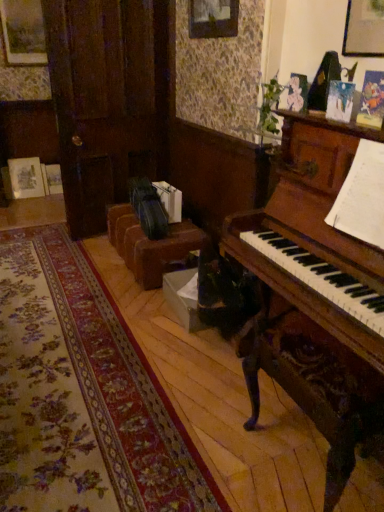
In order to face wooden picture frame at upper right, should I rotate leftwards or rightwards?

You should look right and rotate roughly 24.208 degrees.

This screenshot has width=384, height=512. Describe the element at coordinates (364, 29) in the screenshot. I see `wooden picture frame at upper right` at that location.

Find the location of `wooden picture frame at upper right`. wooden picture frame at upper right is located at coordinates (364, 29).

What is the approximate height of brown leather couch at center?

brown leather couch at center is 13.59 inches tall.

Describe the element at coordinates (150, 245) in the screenshot. The image size is (384, 512). I see `brown leather couch at center` at that location.

Locate an element on the screen. brown leather couch at center is located at coordinates (150, 245).

You are a GUI agent. You are given a task and a screenshot of the screen. Output one action in this format:
    pyautogui.click(x=<x>, y=<y>)
    Task: Click on the wooden picture frame at upper right
    
    Given the screenshot: What is the action you would take?
    click(364, 29)

Is wooden picture frame at upper right to the right of brown leather couch at center from the viewer's perspective?

Yes.

Is wooden picture frame at upper right positioned in front of brown leather couch at center?

Yes.

Does point (379, 2) come behind point (121, 218)?

No, it is in front of (121, 218).

From the image's perspective, which one is positioned lower, wooden picture frame at upper right or brown leather couch at center?

brown leather couch at center.

From a real-world perspective, between wooden picture frame at upper right and brown leather couch at center, who is vertically higher?

wooden picture frame at upper right.

Considering the sizes of wooden picture frame at upper right and brown leather couch at center in the image, is wooden picture frame at upper right wider or thinner than brown leather couch at center?

Considering their sizes, wooden picture frame at upper right looks slimmer than brown leather couch at center.

Considering the relative sizes of wooden picture frame at upper right and brown leather couch at center in the image provided, is wooden picture frame at upper right shorter than brown leather couch at center?

No, wooden picture frame at upper right is not shorter than brown leather couch at center.

Is wooden picture frame at upper right smaller than brown leather couch at center?

Correct, wooden picture frame at upper right occupies less space than brown leather couch at center.

Is wooden picture frame at upper right spatially inside brown leather couch at center, or outside of it?

wooden picture frame at upper right is not enclosed by brown leather couch at center.

Is wooden picture frame at upper right next to brown leather couch at center?

wooden picture frame at upper right is not next to brown leather couch at center, and they're not touching.

Is wooden picture frame at upper right oriented away from brown leather couch at center?

wooden picture frame at upper right does not have its back to brown leather couch at center.

How many degrees apart are the facing directions of wooden picture frame at upper right and brown leather couch at center?

There is a 0.179-degree angle between the facing directions of wooden picture frame at upper right and brown leather couch at center.

Where is `furniture lying behind the wooden picture frame at upper right`? Image resolution: width=384 pixels, height=512 pixels. furniture lying behind the wooden picture frame at upper right is located at coordinates (150, 245).

Which object is positioned more to the right, brown leather couch at center or wooden picture frame at upper right?

From the viewer's perspective, wooden picture frame at upper right appears more on the right side.

Considering the relative positions of brown leather couch at center and wooden picture frame at upper right in the image provided, is brown leather couch at center behind wooden picture frame at upper right?

Yes, the depth of brown leather couch at center is greater than that of wooden picture frame at upper right.

Considering the points (153, 258) and (358, 53), which point is in front, point (153, 258) or point (358, 53)?

Point (358, 53)

From the image's perspective, relative to wooden picture frame at upper right, is brown leather couch at center above or below?

Based on their image positions, brown leather couch at center is located beneath wooden picture frame at upper right.

From a real-world perspective, which object rests below the other?

brown leather couch at center.

Looking at this image, can you confirm if brown leather couch at center is wider than wooden picture frame at upper right?

Indeed, brown leather couch at center has a greater width compared to wooden picture frame at upper right.

Considering the relative sizes of brown leather couch at center and wooden picture frame at upper right in the image provided, is brown leather couch at center taller than wooden picture frame at upper right?

In fact, brown leather couch at center may be shorter than wooden picture frame at upper right.

Based on their sizes in the image, would you say brown leather couch at center is bigger or smaller than wooden picture frame at upper right?

brown leather couch at center is bigger than wooden picture frame at upper right.

Does brown leather couch at center contain wooden picture frame at upper right?

No.

Are brown leather couch at center and wooden picture frame at upper right beside each other?

brown leather couch at center is not next to wooden picture frame at upper right, and they're not touching.

Does brown leather couch at center turn towards wooden picture frame at upper right?

No, brown leather couch at center is not aimed at wooden picture frame at upper right.

What are the coordinates of `picture frame that is above the brown leather couch at center (from the image's perspective)` in the screenshot? It's located at (364, 29).

Image resolution: width=384 pixels, height=512 pixels. Identify the location of picture frame on the right of brown leather couch at center. (364, 29).

The height and width of the screenshot is (512, 384). Find the location of `furniture beneath the wooden picture frame at upper right (from a real-world perspective)`. furniture beneath the wooden picture frame at upper right (from a real-world perspective) is located at coordinates 150,245.